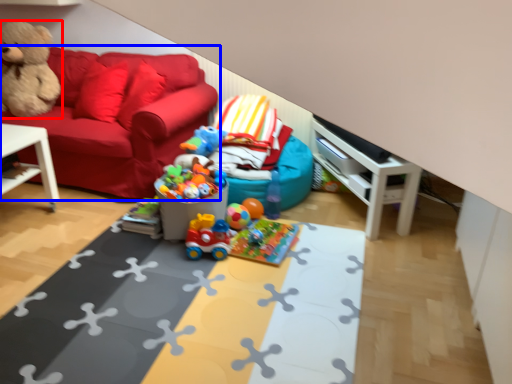
Question: Which point is further to the camera, teddy bear (highlighted by a red box) or studio couch (highlighted by a blue box)?

Choices:
 (A) teddy bear
 (B) studio couch

Answer: (A)